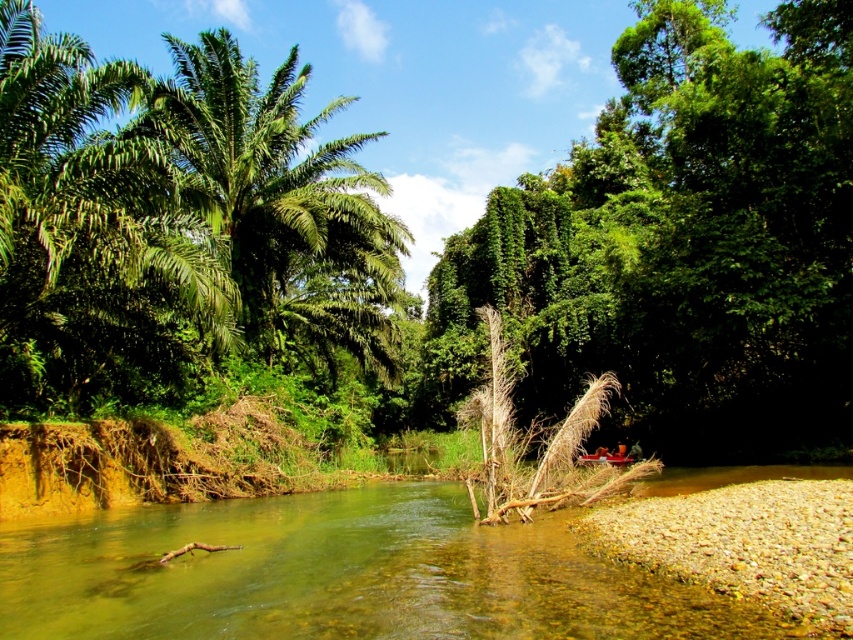
From the picture: You are a bird seeking shelter in the trees. You see a green leafy tree at center and a green leafy palm tree at upper left. Which tree is located to the right of the other?

The green leafy tree at center is positioned on the right side of green leafy palm tree at upper left.